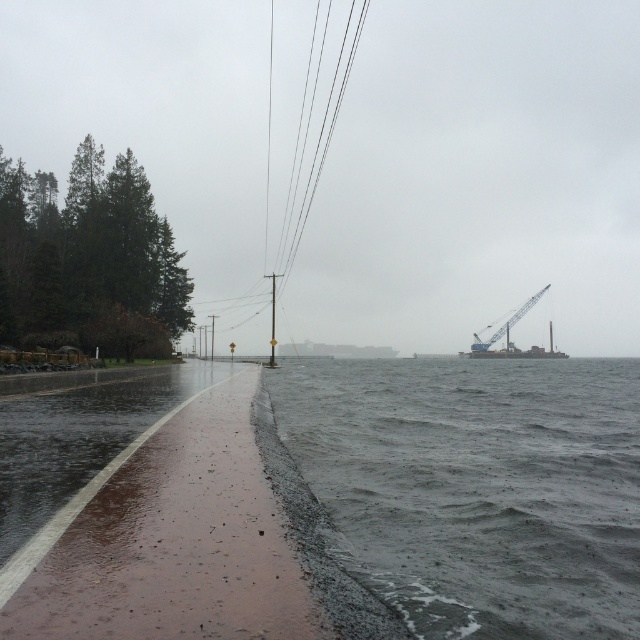
You are a delivery driver approaching the coastal road. You need to avoid the dark gray water at lower right and the metallic blue crane at right. Which object should you steer towards to stay on the road?

The dark gray water at lower right is to the left of the metallic blue crane at right. To stay on the road, steer towards the metallic blue crane at right since it is positioned to the right of the water, keeping you away from the water edge.